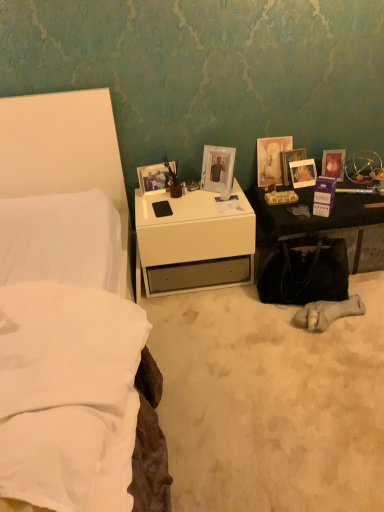
Question: Is matte glass picture frame at upper right, which is the fourth picture frame from right to left, bigger than white fabric bed at upper left?

Choices:
 (A) no
 (B) yes

Answer: (A)

Question: Does matte glass picture frame at upper right, which is the fourth picture frame from right to left, lie behind white fabric bed at upper left?

Choices:
 (A) no
 (B) yes

Answer: (B)

Question: Can you confirm if matte glass picture frame at upper right, which is the third picture frame from left to right, is wider than white fabric bed at upper left?

Choices:
 (A) no
 (B) yes

Answer: (A)

Question: Is matte glass picture frame at upper right, which is the fourth picture frame from right to left, facing away from white fabric bed at upper left?

Choices:
 (A) yes
 (B) no

Answer: (B)

Question: Can you confirm if matte glass picture frame at upper right, which is the third picture frame from left to right, is positioned to the right of white fabric bed at upper left?

Choices:
 (A) yes
 (B) no

Answer: (A)

Question: Is black leather handbag at lower right bigger or smaller than white fabric bed at upper left?

Choices:
 (A) small
 (B) big

Answer: (A)

Question: From a real-world perspective, is black leather handbag at lower right positioned above or below white fabric bed at upper left?

Choices:
 (A) above
 (B) below

Answer: (B)

Question: Relative to white fabric bed at upper left, is black leather handbag at lower right in front or behind?

Choices:
 (A) behind
 (B) front

Answer: (A)

Question: Is black leather handbag at lower right spatially inside white fabric bed at upper left, or outside of it?

Choices:
 (A) inside
 (B) outside

Answer: (B)

Question: Visually, is white fabric bed at upper left positioned to the left or to the right of white glossy nightstand at lower left?

Choices:
 (A) right
 (B) left

Answer: (B)

Question: Do you think white fabric bed at upper left is within white glossy nightstand at lower left, or outside of it?

Choices:
 (A) inside
 (B) outside

Answer: (B)

Question: Looking at their shapes, would you say white fabric bed at upper left is wider or thinner than white glossy nightstand at lower left?

Choices:
 (A) thin
 (B) wide

Answer: (B)

Question: In terms of size, does white fabric bed at upper left appear bigger or smaller than white glossy nightstand at lower left?

Choices:
 (A) big
 (B) small

Answer: (A)

Question: Is matte glass picture frame at right, the 6th picture frame positioned from the left, bigger or smaller than black leather handbag at lower right?

Choices:
 (A) big
 (B) small

Answer: (B)

Question: Does point click(x=329, y=176) appear closer or farther from the camera than point click(x=322, y=242)?

Choices:
 (A) farther
 (B) closer

Answer: (A)